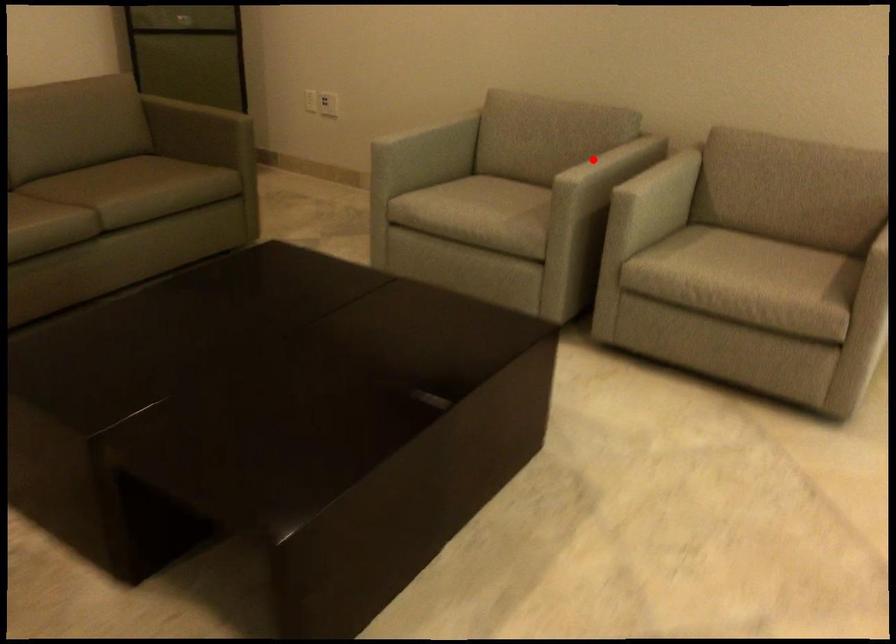
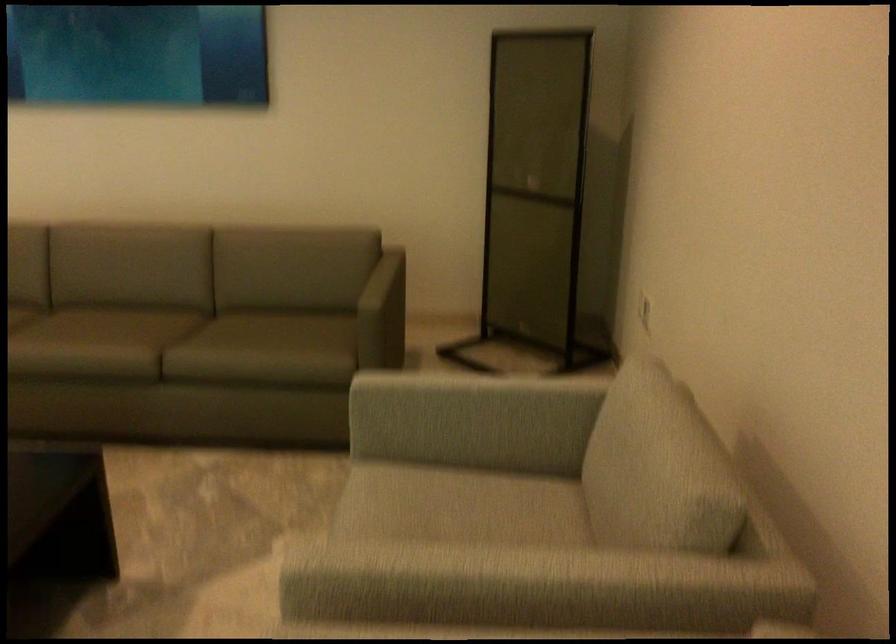
In the second image, find the point that corresponds to the highlighted location in the first image.

(479, 573)